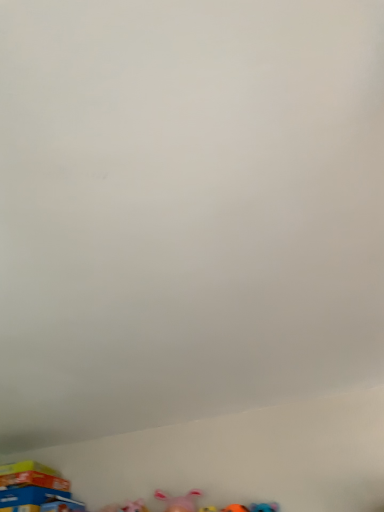
Question: Considering the positions of point tap(46, 492) and point tap(163, 497), is point tap(46, 492) closer or farther from the camera than point tap(163, 497)?

Choices:
 (A) farther
 (B) closer

Answer: (A)

Question: Considering the positions of blue cardboard box at lower left, which appears as the 1th toy when viewed from the back, and pink fabric toy at lower center, which is counted as the 2th toy, starting from the back, in the image, is blue cardboard box at lower left, which appears as the 1th toy when viewed from the back, wider or thinner than pink fabric toy at lower center, which is counted as the 2th toy, starting from the back,?

Choices:
 (A) thin
 (B) wide

Answer: (B)

Question: Would you say blue cardboard box at lower left, which appears as the 1th toy when viewed from the back, is to the left or to the right of pink fabric toy at lower center, which is counted as the 2th toy, starting from the back, in the picture?

Choices:
 (A) right
 (B) left

Answer: (B)

Question: Does point (165, 501) appear closer or farther from the camera than point (51, 496)?

Choices:
 (A) closer
 (B) farther

Answer: (A)

Question: Relative to blue cardboard box at lower left, which ranks as the 2th toy in right-to-left order, is pink fabric toy at lower center, the 1th toy in the right-to-left sequence, in front or behind?

Choices:
 (A) front
 (B) behind

Answer: (A)

Question: Is pink fabric toy at lower center, the 1th toy from the front, taller or shorter than blue cardboard box at lower left, which ranks as the 2th toy in right-to-left order?

Choices:
 (A) tall
 (B) short

Answer: (B)

Question: Visually, is pink fabric toy at lower center, the 1th toy from the front, positioned to the left or to the right of blue cardboard box at lower left, positioned as the second toy in front-to-back order?

Choices:
 (A) right
 (B) left

Answer: (A)